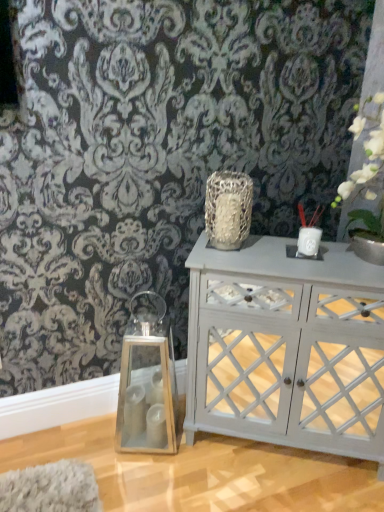
At what (x,y) coordinates should I click in order to perform the action: click on free space to the left of white ceramic candle holder at upper right, which ranks as the second candle holder in top-to-bottom order. Please return your answer as a coordinate pair (x, y). Looking at the image, I should click on (264, 257).